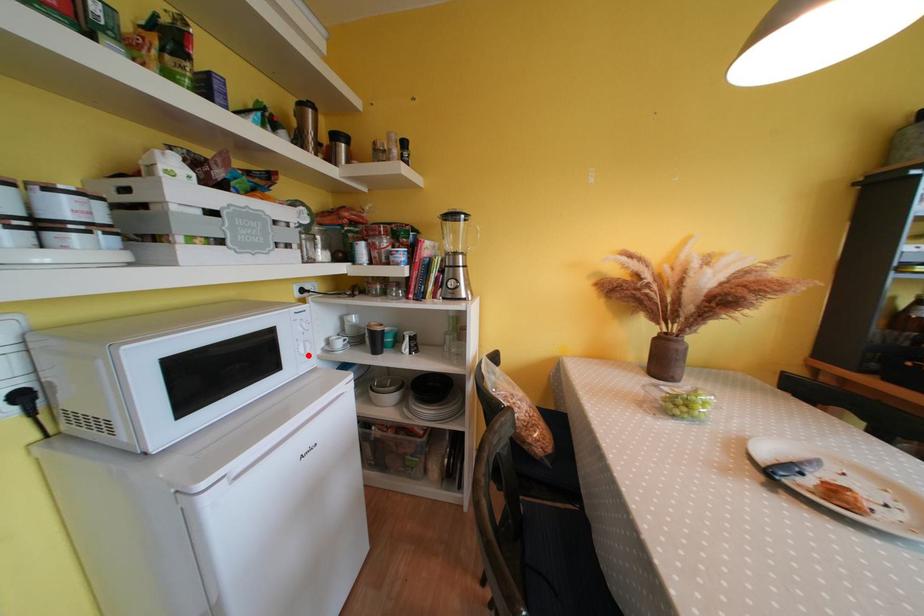
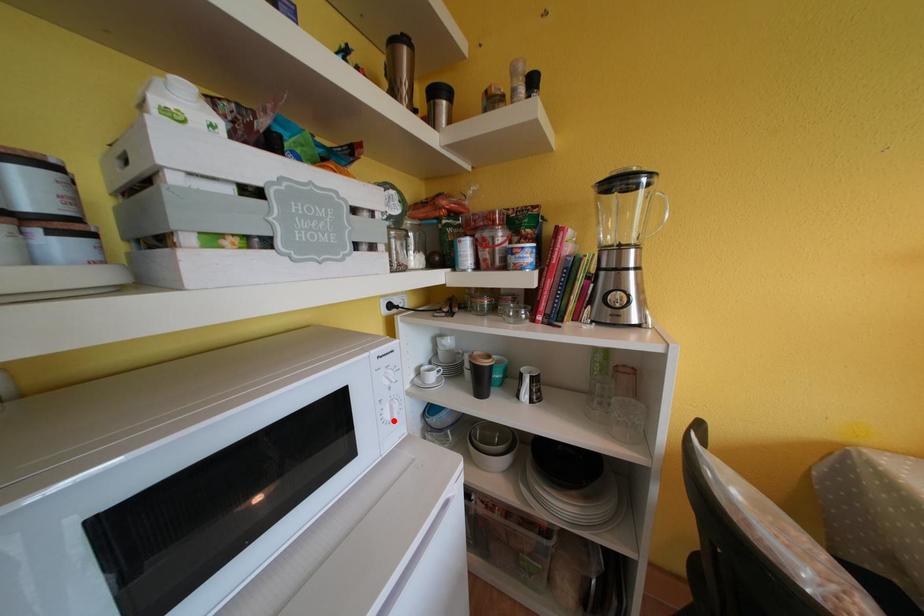
I am providing you with two images of the same scene from different viewpoints. A red point is marked on the first image and another point is marked on the second image. Is the marked point in image1 the same physical position as the marked point in image2?

Yes